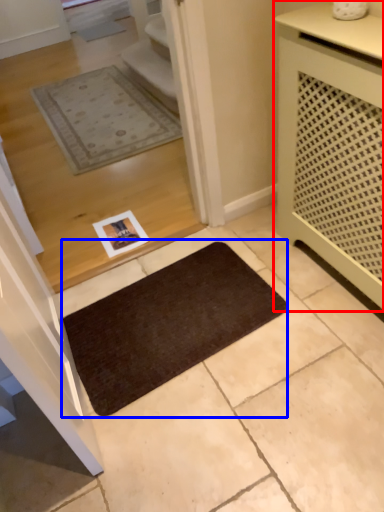
Question: Which point is closer to the camera, cabinetry (highlighted by a red box) or mat (highlighted by a blue box)?

Choices:
 (A) cabinetry
 (B) mat

Answer: (A)